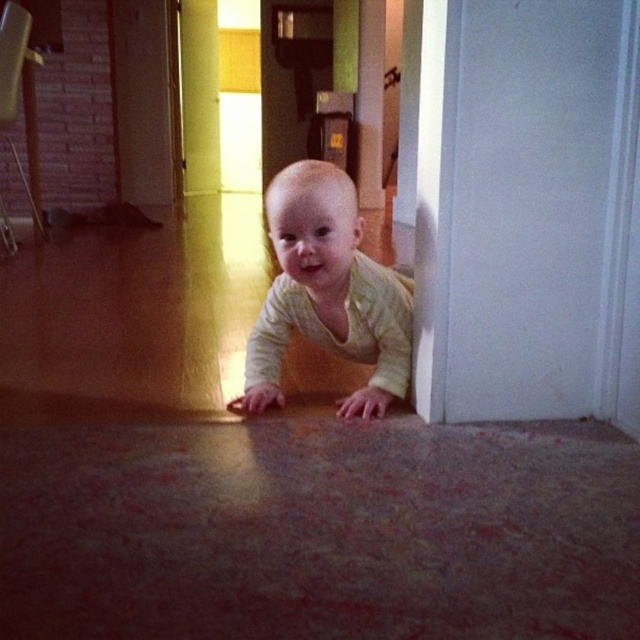
Does light yellow striped shirt at center come in front of matte yellow door at upper left?

Yes, light yellow striped shirt at center is in front of matte yellow door at upper left.

Between point (326, 193) and point (112, 6), which one is positioned behind?

The point (112, 6) is more distant.

Locate an element on the screen. light yellow striped shirt at center is located at coordinates (326, 292).